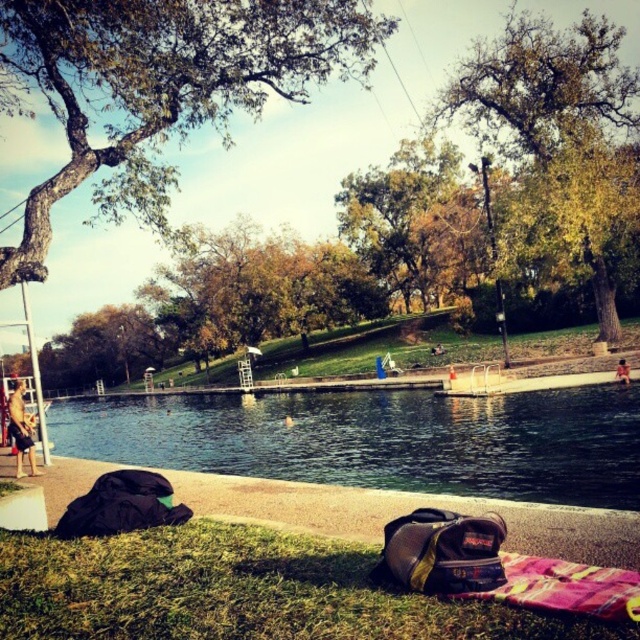
This screenshot has width=640, height=640. Find the location of `clear blue water at center`. clear blue water at center is located at coordinates (380, 440).

Does clear blue water at center have a smaller size compared to tan skin person at lower left?

Actually, clear blue water at center might be larger than tan skin person at lower left.

Does point (448, 435) come behind point (20, 467)?

That is True.

Find the location of a particular element. This screenshot has height=640, width=640. clear blue water at center is located at coordinates (380, 440).

Does green leafy tree at upper left appear under clear blue water at center?

No, green leafy tree at upper left is not below clear blue water at center.

Which is in front, point (56, 56) or point (189, 433)?

Point (56, 56)

Between point (134, 109) and point (564, 497), which one is positioned in front?

Positioned in front is point (134, 109).

This screenshot has width=640, height=640. Find the location of `green leafy tree at upper left`. green leafy tree at upper left is located at coordinates (160, 86).

Is black fabric sleeping bag at lower left thinner than tan skin person at lower left?

No.

From the picture: Who is more distant from viewer, [61,524] or [17,433]?

Positioned behind is point [17,433].

Find the location of a particular element. The width and height of the screenshot is (640, 640). black fabric sleeping bag at lower left is located at coordinates (122, 506).